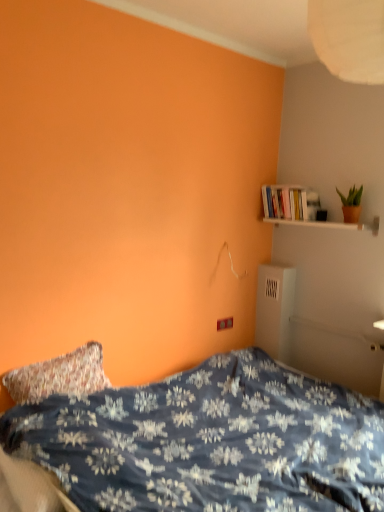
Question: Is green matte plant at upper right turned away from blue floral fabric bed at lower left?

Choices:
 (A) no
 (B) yes

Answer: (A)

Question: Does green matte plant at upper right contain blue floral fabric bed at lower left?

Choices:
 (A) yes
 (B) no

Answer: (B)

Question: Is the position of green matte plant at upper right less distant than that of blue floral fabric bed at lower left?

Choices:
 (A) yes
 (B) no

Answer: (B)

Question: From the image's perspective, is green matte plant at upper right over blue floral fabric bed at lower left?

Choices:
 (A) yes
 (B) no

Answer: (A)

Question: Does green matte plant at upper right appear on the right side of blue floral fabric bed at lower left?

Choices:
 (A) no
 (B) yes

Answer: (B)

Question: Considering the relative positions of green matte plant at upper right and blue floral fabric bed at lower left in the image provided, is green matte plant at upper right behind blue floral fabric bed at lower left?

Choices:
 (A) no
 (B) yes

Answer: (B)

Question: Does blue floral fabric bed at lower left have a larger size compared to white glossy bookshelf at upper right?

Choices:
 (A) no
 (B) yes

Answer: (B)

Question: Is blue floral fabric bed at lower left at the right side of white glossy bookshelf at upper right?

Choices:
 (A) no
 (B) yes

Answer: (A)

Question: Does blue floral fabric bed at lower left have a lesser width compared to white glossy bookshelf at upper right?

Choices:
 (A) yes
 (B) no

Answer: (B)

Question: Would you consider blue floral fabric bed at lower left to be distant from white glossy bookshelf at upper right?

Choices:
 (A) yes
 (B) no

Answer: (A)

Question: Is blue floral fabric bed at lower left oriented away from white glossy bookshelf at upper right?

Choices:
 (A) no
 (B) yes

Answer: (A)

Question: Considering the relative sizes of blue floral fabric bed at lower left and white glossy bookshelf at upper right in the image provided, is blue floral fabric bed at lower left smaller than white glossy bookshelf at upper right?

Choices:
 (A) yes
 (B) no

Answer: (B)

Question: Considering the relative sizes of green matte plant at upper right and white wooden shelf at upper right in the image provided, is green matte plant at upper right taller than white wooden shelf at upper right?

Choices:
 (A) no
 (B) yes

Answer: (B)